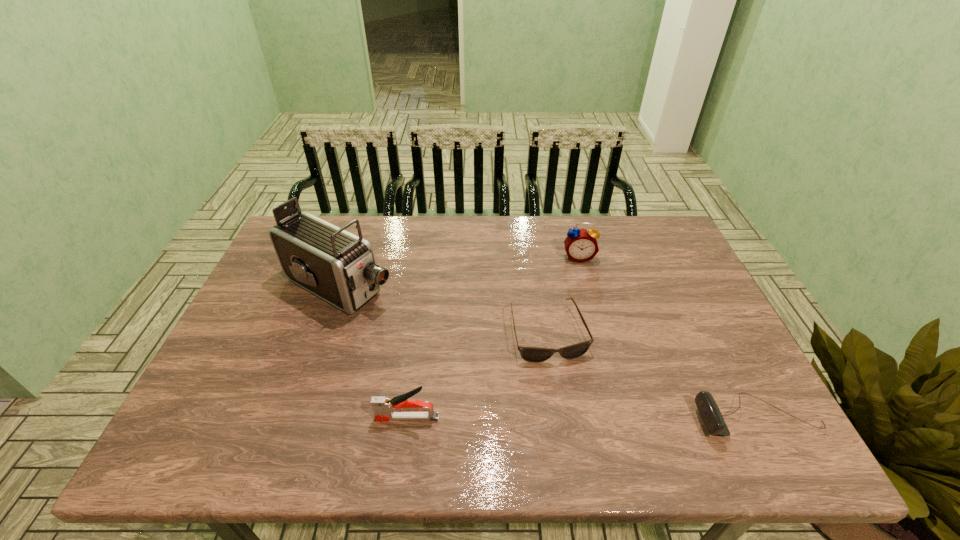
The image size is (960, 540). In order to click on free space located on the handle side of the fourth object from right to left in this screenshot , I will do `click(212, 417)`.

Identify the location of free space located on the front-facing side of the rightmost object. The height and width of the screenshot is (540, 960). (595, 417).

Locate an element on the screen. The height and width of the screenshot is (540, 960). vacant region located on the front-facing side of the rightmost object is located at coordinates (627, 417).

Image resolution: width=960 pixels, height=540 pixels. I want to click on vacant area located 0.380m on the front-facing side of the rightmost object, so click(522, 417).

Find the location of a particular element. The image size is (960, 540). blank space located 0.050m on the lenses of the shortest object is located at coordinates (564, 380).

You are a GUI agent. You are given a task and a screenshot of the screen. Output one action in this format:
    pyautogui.click(x=<x>, y=<y>)
    Task: Click on the vacant area situated on the lenses of the shortest object
    The height and width of the screenshot is (540, 960).
    Given the screenshot: What is the action you would take?
    pyautogui.click(x=575, y=417)

The width and height of the screenshot is (960, 540). What are the coordinates of `free space located 0.270m on the front-facing side of the second tallest object` in the screenshot? It's located at (589, 330).

Image resolution: width=960 pixels, height=540 pixels. In order to click on vacant region located on the front-facing side of the second tallest object in this screenshot , I will do `click(586, 303)`.

Where is `vacant area situated on the front-facing side of the second tallest object`? Image resolution: width=960 pixels, height=540 pixels. vacant area situated on the front-facing side of the second tallest object is located at coordinates (586, 305).

Locate an element on the screen. This screenshot has height=540, width=960. vacant area situated at the lens of the camcorder is located at coordinates (469, 349).